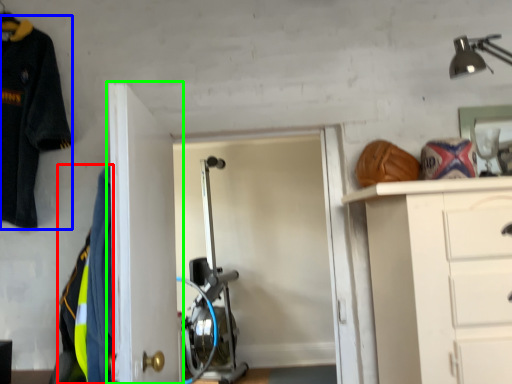
Question: Considering the real-world distances, which object is closest to uniform (highlighted by a red box)? uniform (highlighted by a blue box) or door (highlighted by a green box).

Choices:
 (A) uniform
 (B) door

Answer: (B)